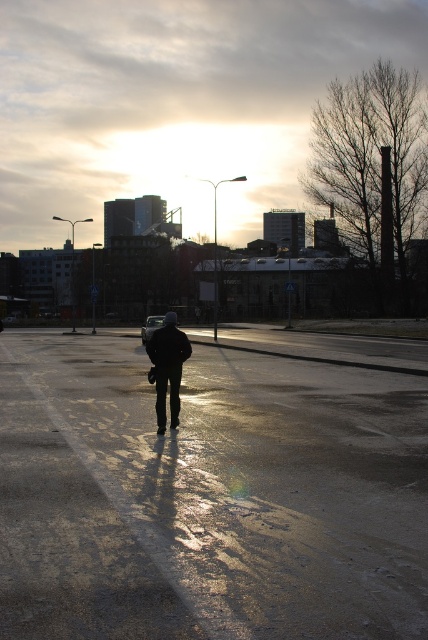
Question: Can you confirm if shiny asphalt parking lot at center is smaller than dark matte jacket at center?

Choices:
 (A) yes
 (B) no

Answer: (A)

Question: Can you confirm if shiny asphalt parking lot at center is smaller than dark matte jacket at center?

Choices:
 (A) no
 (B) yes

Answer: (B)

Question: Which of the following is the farthest from the observer?

Choices:
 (A) (302, 336)
 (B) (174, 339)

Answer: (A)

Question: Can you confirm if shiny asphalt parking lot at center is smaller than dark matte jacket at center?

Choices:
 (A) yes
 (B) no

Answer: (A)

Question: Which point is closer to the camera?

Choices:
 (A) (290, 605)
 (B) (158, 394)

Answer: (A)